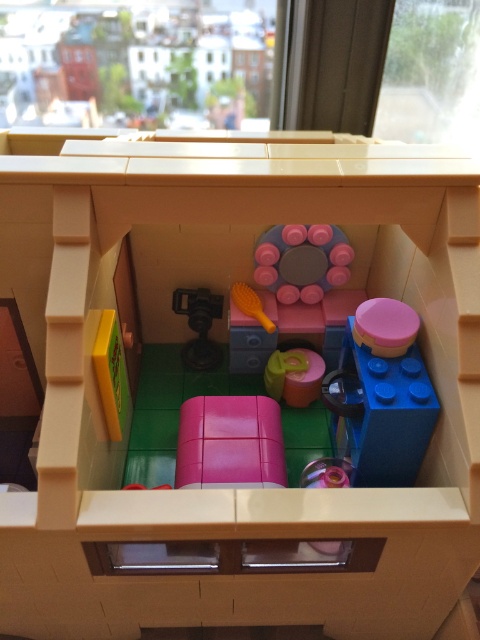
You are organizing a LEGO set and need to place the blue plastic cup at center right and the yellow plastic brush at center into a storage box. If the storage box has a compartment that can only fit items narrower than the cup, which item should you place in that compartment?

The yellow plastic brush at center should be placed in the compartment since the blue plastic cup at center right might be wider than it, making the brush narrower and suitable for the compartment.